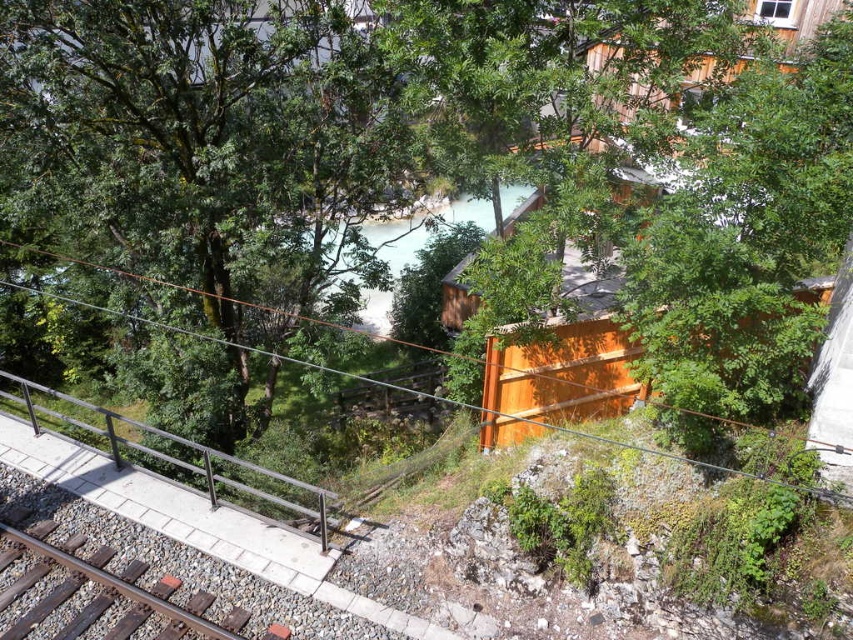
Can you confirm if green leafy tree at center is positioned below brown metal train track at lower left?

No, green leafy tree at center is not below brown metal train track at lower left.

What do you see at coordinates (462, 157) in the screenshot? The width and height of the screenshot is (853, 640). I see `green leafy tree at center` at bounding box center [462, 157].

The height and width of the screenshot is (640, 853). In order to click on green leafy tree at center in this screenshot , I will do `click(462, 157)`.

Is green leafy tree at center closer to the viewer compared to metal/rustic rail at lower left?

Yes, green leafy tree at center is closer to the viewer.

Is point (590, 202) farther from viewer compared to point (184, 477)?

No, (590, 202) is closer to viewer.

The width and height of the screenshot is (853, 640). Describe the element at coordinates (462, 157) in the screenshot. I see `green leafy tree at center` at that location.

What are the coordinates of `green leafy tree at center` in the screenshot? It's located at (462, 157).

Which of these two, metal/rustic rail at lower left or brown metal train track at lower left, stands taller?

Standing taller between the two is metal/rustic rail at lower left.

From the picture: Can you confirm if metal/rustic rail at lower left is positioned below brown metal train track at lower left?

No, metal/rustic rail at lower left is not below brown metal train track at lower left.

At what (x,y) coordinates should I click in order to perform the action: click on metal/rustic rail at lower left. Please return your answer as a coordinate pair (x, y). The width and height of the screenshot is (853, 640). Looking at the image, I should click on (169, 456).